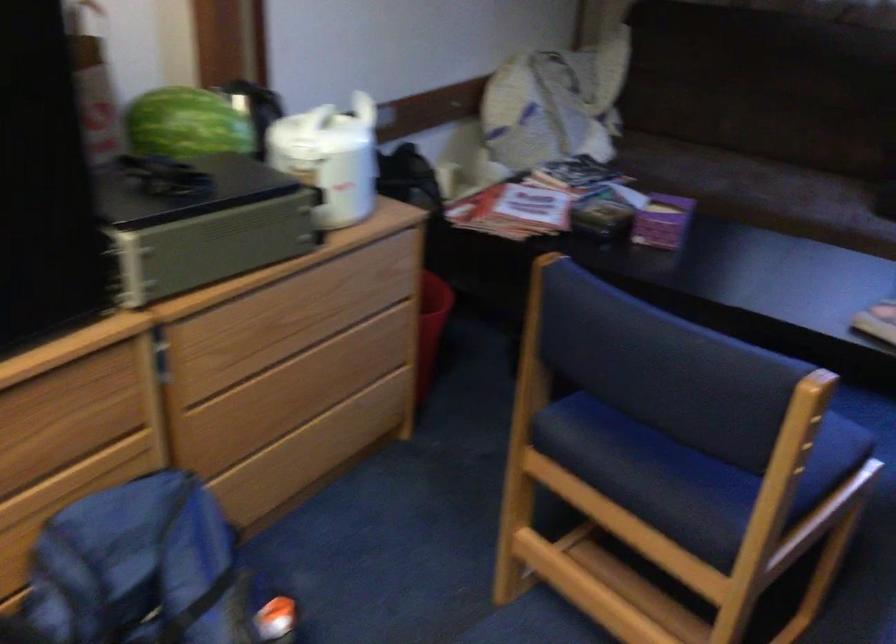
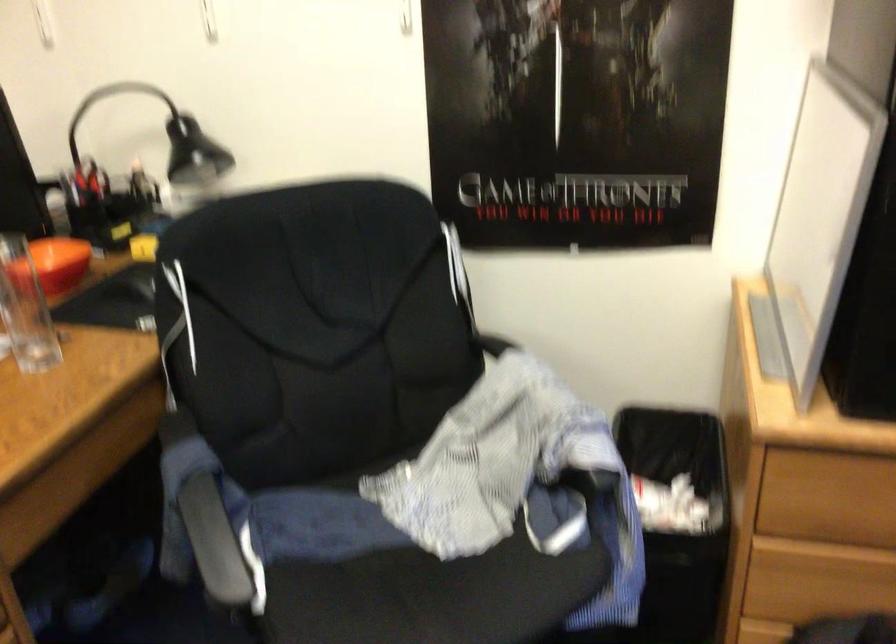
Question: The first image is from the beginning of the video and the second image is from the end. How did the camera likely rotate when shooting the video?

Choices:
 (A) Left
 (B) Right
 (C) Up
 (D) Down

Answer: (A)